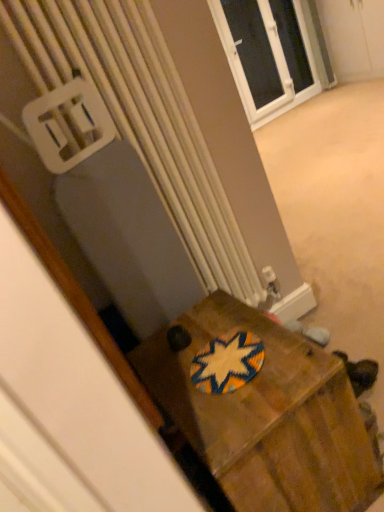
Question: Considering the relative sizes of white plastic radiator at center and white plastic window at upper center in the image provided, is white plastic radiator at center bigger than white plastic window at upper center?

Choices:
 (A) yes
 (B) no

Answer: (B)

Question: Considering the relative positions of white plastic radiator at center and white plastic window at upper center in the image provided, is white plastic radiator at center to the right of white plastic window at upper center from the viewer's perspective?

Choices:
 (A) no
 (B) yes

Answer: (A)

Question: Considering the relative sizes of white plastic radiator at center and white plastic window at upper center in the image provided, is white plastic radiator at center smaller than white plastic window at upper center?

Choices:
 (A) yes
 (B) no

Answer: (A)

Question: Can you confirm if white plastic radiator at center is wider than white plastic window at upper center?

Choices:
 (A) yes
 (B) no

Answer: (A)

Question: Is white plastic radiator at center behind white plastic window at upper center?

Choices:
 (A) yes
 (B) no

Answer: (B)

Question: From the image's perspective, is white plastic window at upper center above or below white plastic radiator at center?

Choices:
 (A) above
 (B) below

Answer: (A)

Question: Do you think white plastic window at upper center is within white plastic radiator at center, or outside of it?

Choices:
 (A) inside
 (B) outside

Answer: (B)

Question: From their relative heights in the image, would you say white plastic window at upper center is taller or shorter than white plastic radiator at center?

Choices:
 (A) tall
 (B) short

Answer: (A)

Question: Is white plastic window at upper center bigger or smaller than white plastic radiator at center?

Choices:
 (A) big
 (B) small

Answer: (A)

Question: From a real-world perspective, is woven fabric coaster at center above or below white plastic radiator at center?

Choices:
 (A) above
 (B) below

Answer: (B)

Question: In terms of height, does woven fabric coaster at center look taller or shorter compared to white plastic radiator at center?

Choices:
 (A) tall
 (B) short

Answer: (B)

Question: Is woven fabric coaster at center spatially inside white plastic radiator at center, or outside of it?

Choices:
 (A) inside
 (B) outside

Answer: (B)

Question: From the image's perspective, is woven fabric coaster at center located above or below white plastic radiator at center?

Choices:
 (A) below
 (B) above

Answer: (A)

Question: Is white plastic radiator at center taller or shorter than wooden box at center?

Choices:
 (A) tall
 (B) short

Answer: (A)

Question: Visually, is white plastic radiator at center positioned to the left or to the right of wooden box at center?

Choices:
 (A) left
 (B) right

Answer: (A)